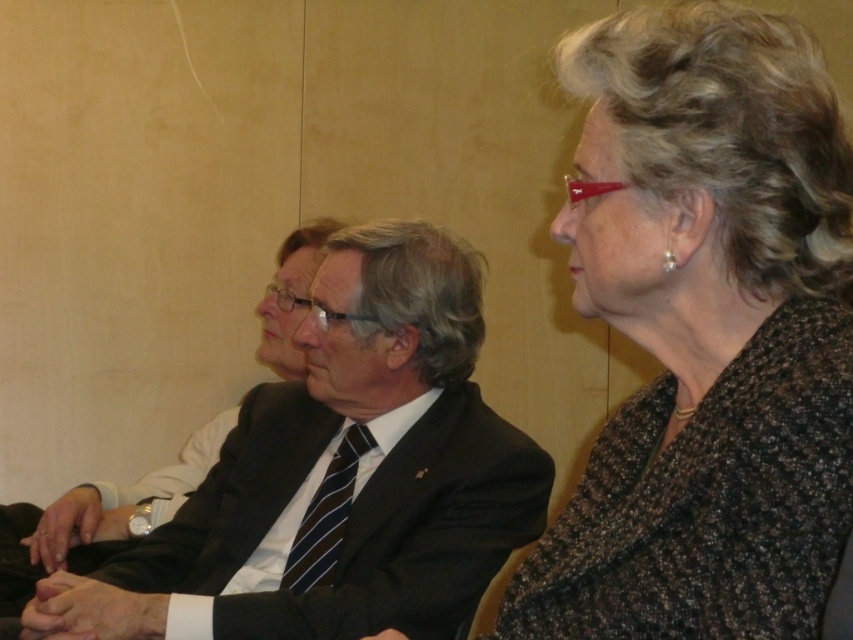
You are standing in front of the three seated individuals. There are two points marked on the wall behind them. One point is at coordinates (106, 582) and the other at (328, 509). Which point is closer to you?

The point at coordinates (106, 582) is closer to you because it is in front of the point at (328, 509).

Based on the scene, which object is positioned to the left of the other between the smooth skin hands at center and the dark blue striped tie at center?

The smooth skin hands at center are positioned to the left of the dark blue striped tie at center.

You are standing in front of the three people in the image. There are two points marked on the man in the middle. One is at coordinate point (262, 512) and the other is at point (334, 552). Which point is closer to you?

Point (262, 512) is closer to you because it is further to the camera than point (334, 552).